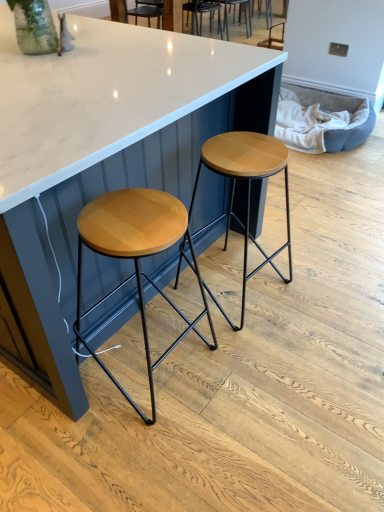
Locate an element on the screen. space that is in front of wooden matte stool at center, which is the 2th stool in left-to-right order is located at coordinates (259, 361).